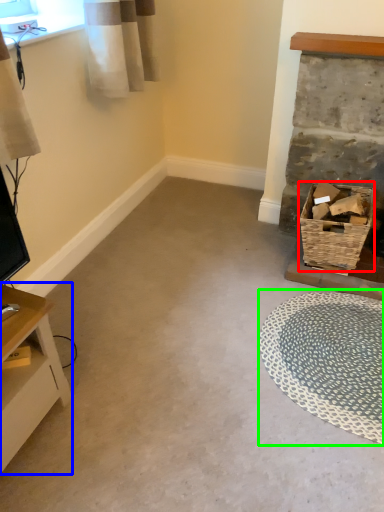
Question: Estimate the real-world distances between objects in this image. Which object is closer to basket (highlighted by a red box), table (highlighted by a blue box) or mat (highlighted by a green box)?

Choices:
 (A) table
 (B) mat

Answer: (B)